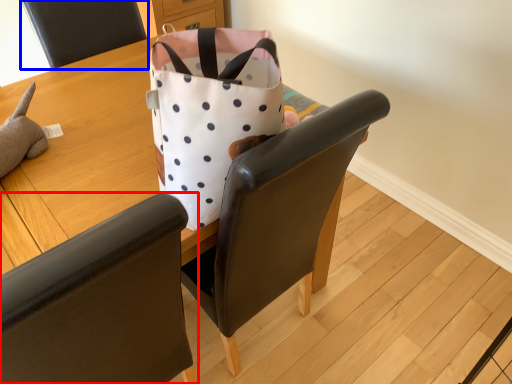
Question: Which object is further to the camera taking this photo, chair (highlighted by a red box) or chair (highlighted by a blue box)?

Choices:
 (A) chair
 (B) chair

Answer: (B)